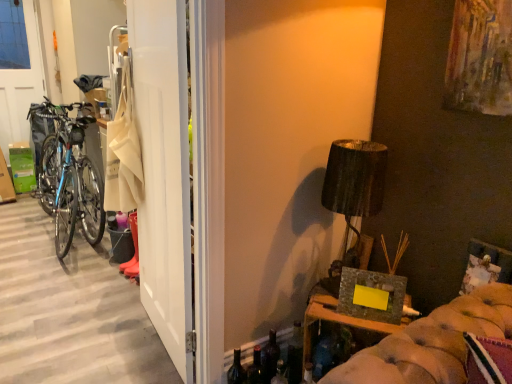
Question: In the image, is stone-like textured frame at lower right on the left side or the right side of white matte door at left?

Choices:
 (A) right
 (B) left

Answer: (A)

Question: Considering the positions of stone-like textured frame at lower right and white matte door at left in the image, is stone-like textured frame at lower right wider or thinner than white matte door at left?

Choices:
 (A) wide
 (B) thin

Answer: (A)

Question: Considering the real-world distances, which object is closest to the matte black lampshade at upper right?

Choices:
 (A) translucent glass bottle at lower center, the second bottle viewed from the right
 (B) shiny blue frame bicycle at left
 (C) stone-like textured frame at lower right
 (D) translucent glass bottle at lower center, the first bottle positioned from the right
 (E) white matte door at left

Answer: (C)

Question: Which is farther from the translucent glass bottle at lower center, the first bottle positioned from the right?

Choices:
 (A) white matte door at left
 (B) transparent plastic screen door at left
 (C) translucent glass bottle at lower center, positioned as the 2th bottle in left-to-right order
 (D) stone-like textured frame at lower right
 (E) shiny blue frame bicycle at left

Answer: (B)